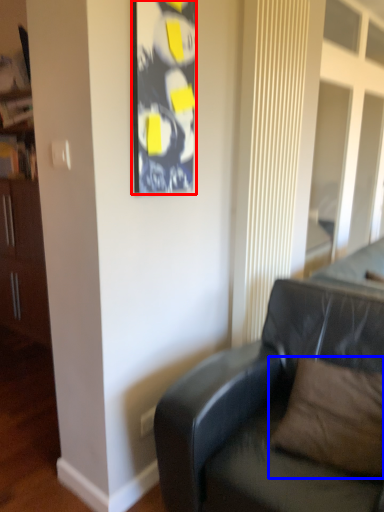
Question: Among these objects, which one is farthest to the camera, picture frame (highlighted by a red box) or pillow (highlighted by a blue box)?

Choices:
 (A) picture frame
 (B) pillow

Answer: (A)